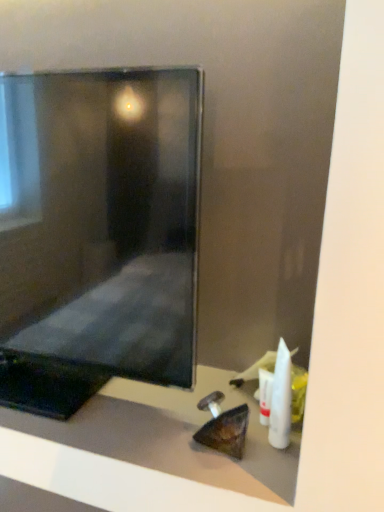
Question: Can you confirm if matte black monitor at center is smaller than white plastic tube at lower right, the second toiletry viewed from the front?

Choices:
 (A) yes
 (B) no

Answer: (B)

Question: Does matte black monitor at center have a larger size compared to white plastic tube at lower right, the second toiletry viewed from the front?

Choices:
 (A) no
 (B) yes

Answer: (B)

Question: Does matte black monitor at center appear on the left side of white plastic tube at lower right, the second toiletry viewed from the front?

Choices:
 (A) no
 (B) yes

Answer: (B)

Question: Considering the relative sizes of matte black monitor at center and white plastic tube at lower right, the second toiletry viewed from the front, in the image provided, is matte black monitor at center thinner than white plastic tube at lower right, the second toiletry viewed from the front,?

Choices:
 (A) yes
 (B) no

Answer: (B)

Question: Considering the relative sizes of matte black monitor at center and white plastic tube at lower right, placed as the 1th toiletry when sorted from back to front, in the image provided, is matte black monitor at center wider than white plastic tube at lower right, placed as the 1th toiletry when sorted from back to front,?

Choices:
 (A) yes
 (B) no

Answer: (A)

Question: Is white plastic tube at lower right, the second toiletry viewed from the front, at the back of matte black monitor at center?

Choices:
 (A) yes
 (B) no

Answer: (B)

Question: Is white plastic toothbrush at lower right, which ranks as the first toiletry in front-to-back order, oriented away from matte black monitor at center?

Choices:
 (A) no
 (B) yes

Answer: (A)

Question: From the image's perspective, does white plastic toothbrush at lower right, which is the second toiletry in back-to-front order, appear higher than matte black monitor at center?

Choices:
 (A) no
 (B) yes

Answer: (B)

Question: Does white plastic toothbrush at lower right, which is the second toiletry in back-to-front order, appear on the right side of matte black monitor at center?

Choices:
 (A) no
 (B) yes

Answer: (B)

Question: Would you say white plastic toothbrush at lower right, which is the second toiletry in back-to-front order, is outside matte black monitor at center?

Choices:
 (A) no
 (B) yes

Answer: (B)

Question: Is white plastic toothbrush at lower right, which ranks as the first toiletry in front-to-back order, placed right next to matte black monitor at center?

Choices:
 (A) no
 (B) yes

Answer: (A)

Question: Considering the relative sizes of white plastic toothbrush at lower right, which ranks as the first toiletry in front-to-back order, and matte black monitor at center in the image provided, is white plastic toothbrush at lower right, which ranks as the first toiletry in front-to-back order, smaller than matte black monitor at center?

Choices:
 (A) no
 (B) yes

Answer: (B)

Question: From a real-world perspective, is white plastic toothbrush at lower right, which is the second toiletry in back-to-front order, on top of matte black monitor at center?

Choices:
 (A) no
 (B) yes

Answer: (A)